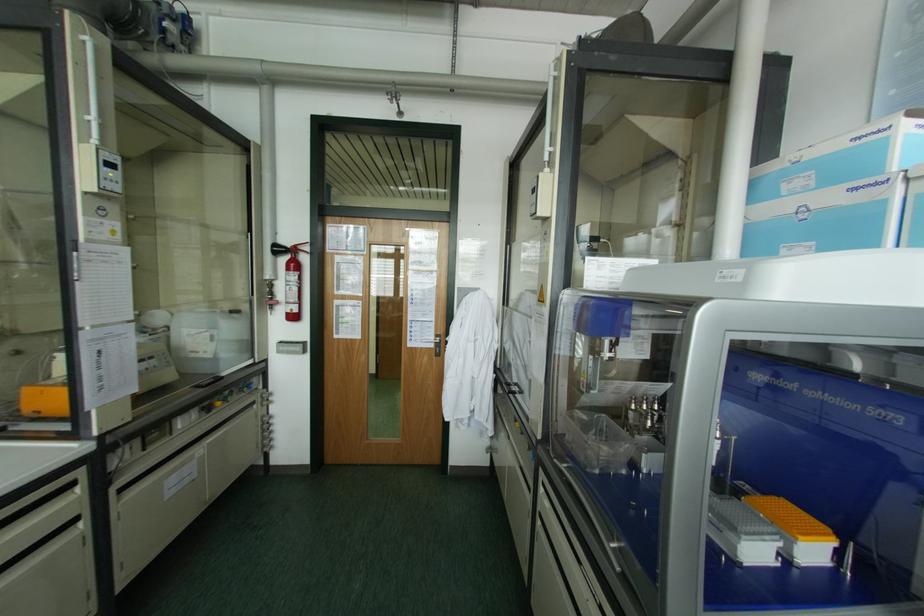
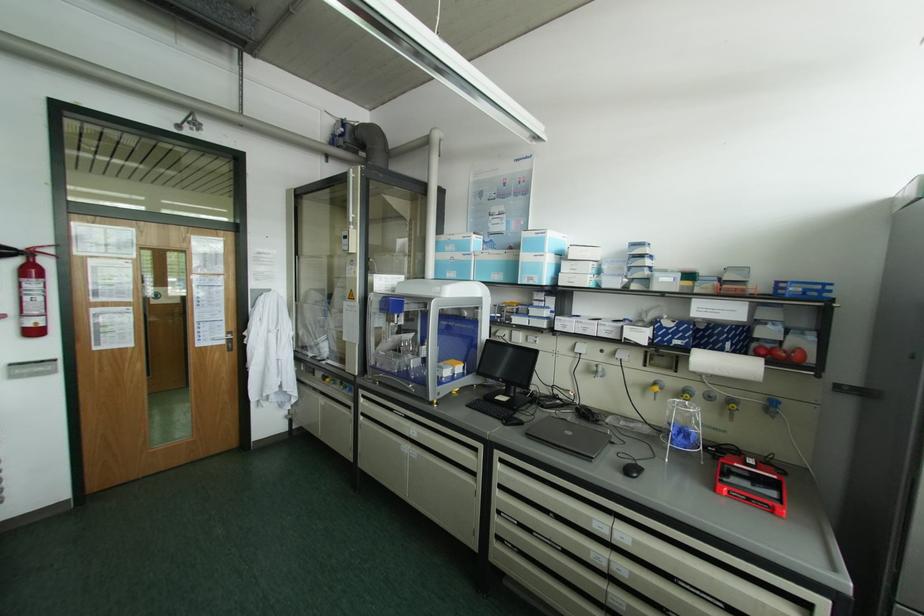
The point at (829, 198) is marked in the first image. Where is the corresponding point in the second image?

(457, 256)